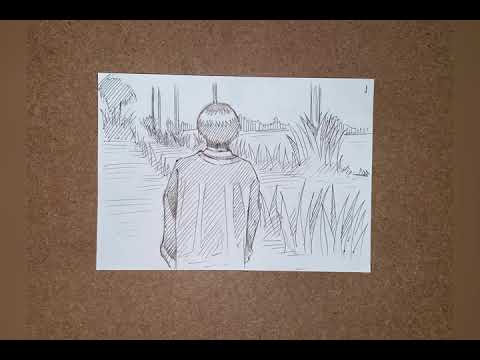
This screenshot has width=480, height=360. I want to click on table, so click(300, 353).